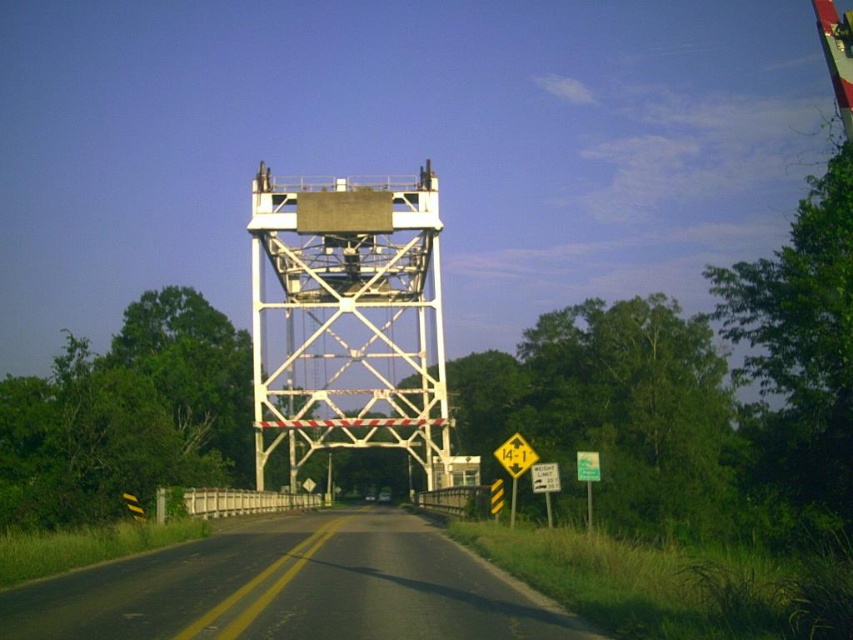
Question: In this image, where is black asphalt road at center located relative to yellow reflective plastic triangle at center?

Choices:
 (A) left
 (B) right

Answer: (A)

Question: Which object is positioned closest to the yellow reflective plastic triangle at center?

Choices:
 (A) green plastic sign at lower right
 (B) white metallic tower at center

Answer: (A)

Question: Estimate the real-world distances between objects in this image. Which object is farther from the black asphalt road at center?

Choices:
 (A) green plastic sign at lower right
 (B) white metallic tower at center
 (C) yellow reflective plastic triangle at center

Answer: (B)

Question: Which point appears closest to the camera in this image?

Choices:
 (A) (524, 451)
 (B) (270, 356)

Answer: (A)

Question: Can you confirm if white metallic tower at center is bigger than black asphalt road at center?

Choices:
 (A) yes
 (B) no

Answer: (A)

Question: Is white metallic tower at center wider than green plastic sign at lower right?

Choices:
 (A) yes
 (B) no

Answer: (A)